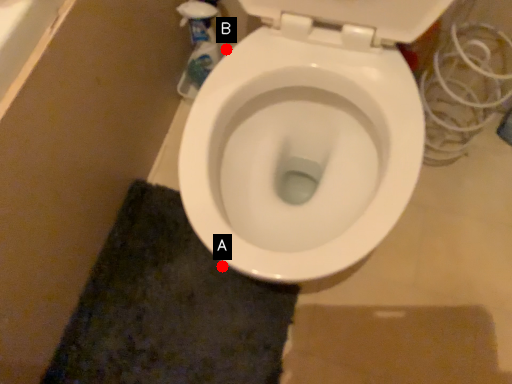
Question: Two points are circled on the image, labeled by A and B beside each circle. Which point is closer to the camera?

Choices:
 (A) A is closer
 (B) B is closer

Answer: (A)